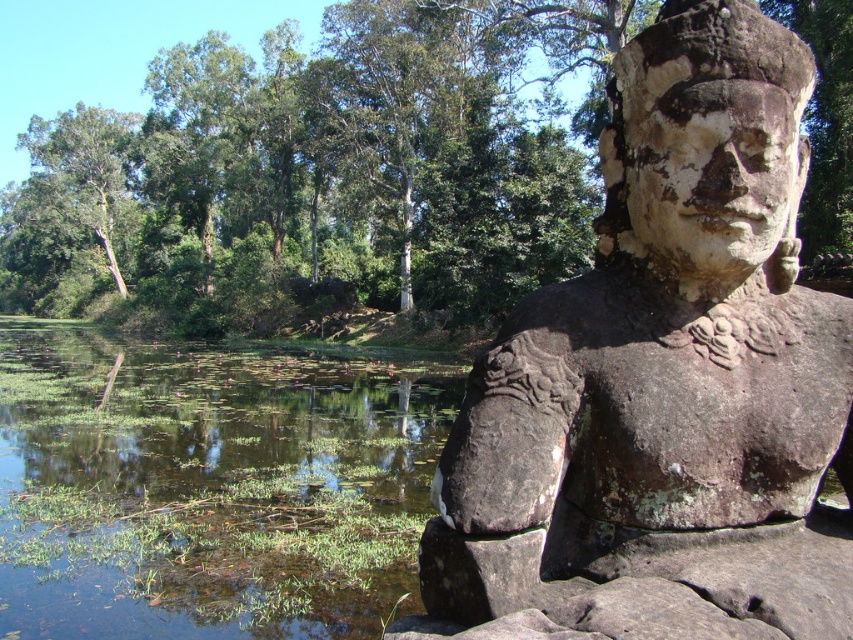
You are standing at the center of the image and want to locate the green leafy tree at upper center. According to the coordinates provided, in which direction should you look to find it?

The green leafy tree at upper center is located at coordinates point (318, 172), so you should look towards the upper center direction to find it.

You are standing in the serene natural setting and want to take a photo of both the green leafy tree at upper center and the green grassy river at lower left. Which object should you focus on first to ensure both are in clear view?

You should focus on the green leafy tree at upper center first because it is closer to the viewer than the green grassy river at lower left, ensuring both are in focus when adjusting the camera settings.

You are an architect analyzing the spatial layout of this historical site. You need to determine which object takes up more area in the scene between the weathered stone statue at right and the green leafy tree at upper left. Based on the scene, which one would you say occupies more space?

The green leafy tree at upper left occupies more space than the weathered stone statue at right in the scene.